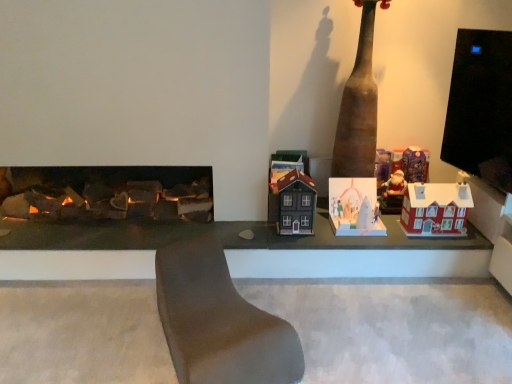
Where is `vacant space to the left of brown leather couch at center`? This screenshot has height=384, width=512. vacant space to the left of brown leather couch at center is located at coordinates (95, 333).